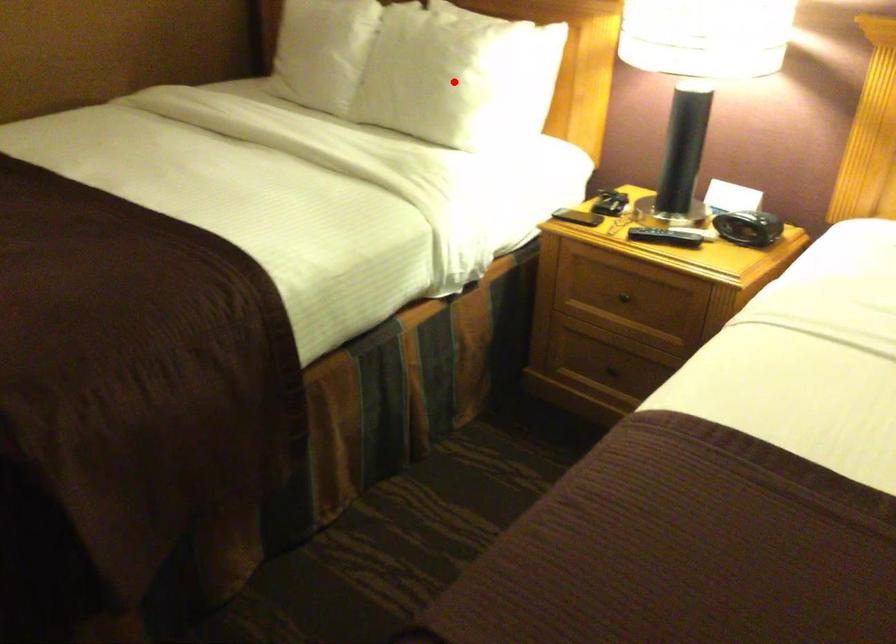
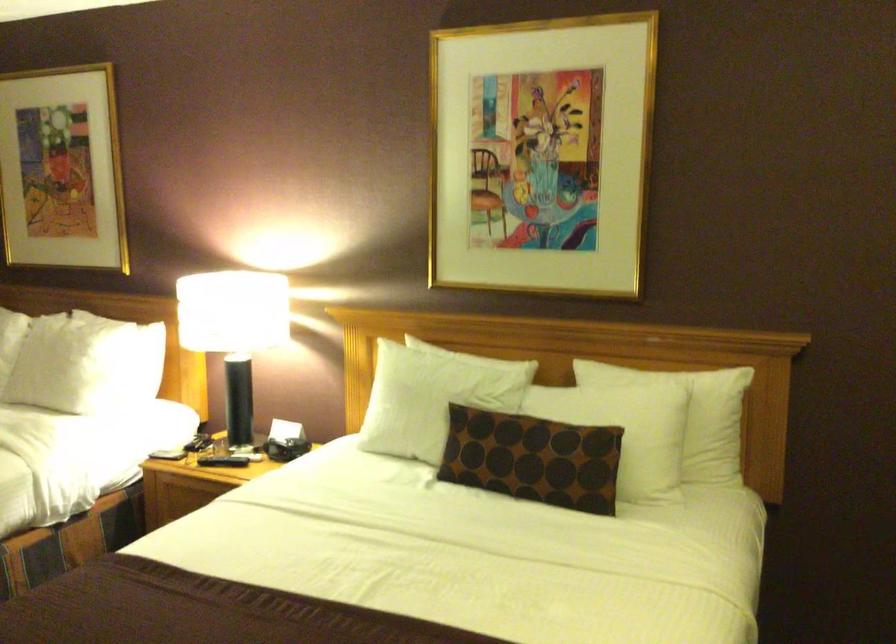
Question: A red point is marked in image1. In image2, is the corresponding 3D point closer to the camera or farther? Reply with the corresponding letter.

Choices:
 (A) The corresponding 3D point is closer.
 (B) The corresponding 3D point is farther.

Answer: (B)